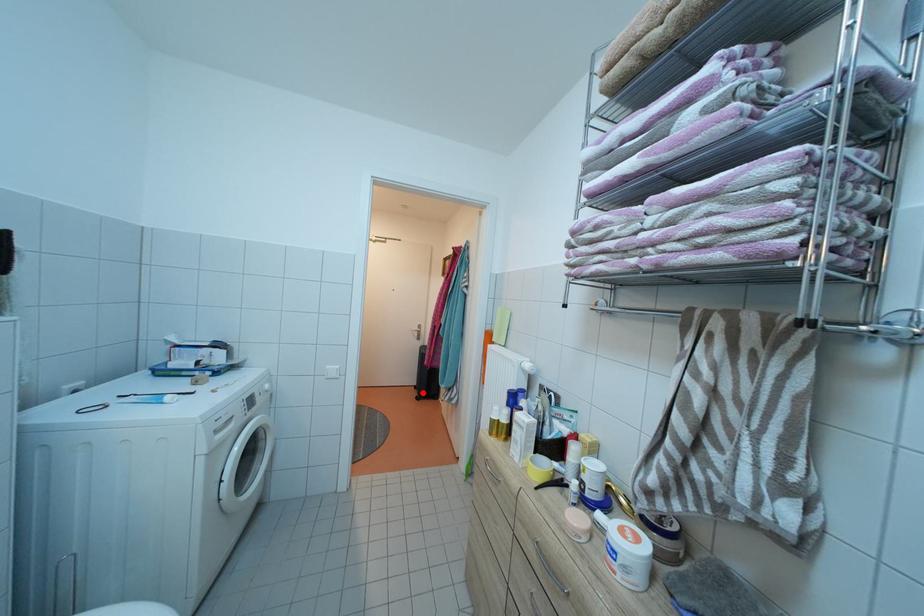
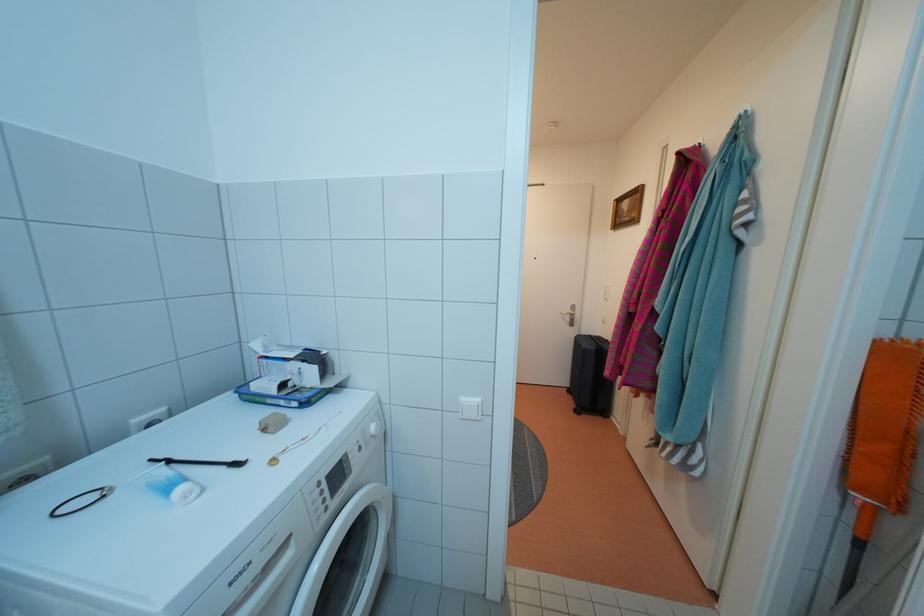
Question: I am providing you with two images of the same scene from different viewpoints. Image1 has a red point marked. In image2, the corresponding 3D location appears at what relative position? Reply with the corresponding letter.

Choices:
 (A) Closer
 (B) Farther

Answer: (A)